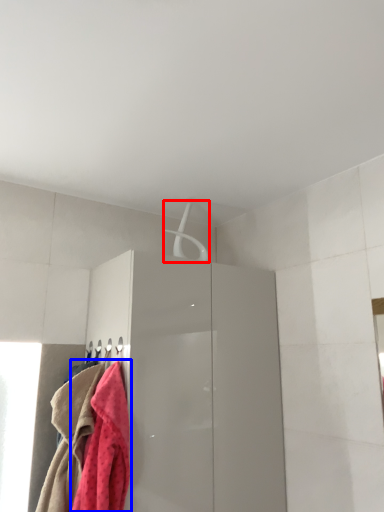
Question: Which of the following is the farthest to the observer, hanger (highlighted by a red box) or towel (highlighted by a blue box)?

Choices:
 (A) hanger
 (B) towel

Answer: (A)